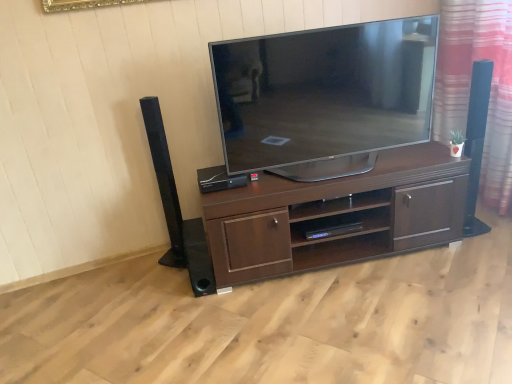
Identify the location of blank space situated above black plastic speaker at center, arranged as the 1th speaker when viewed from the right (from a real-world perspective). (218, 173).